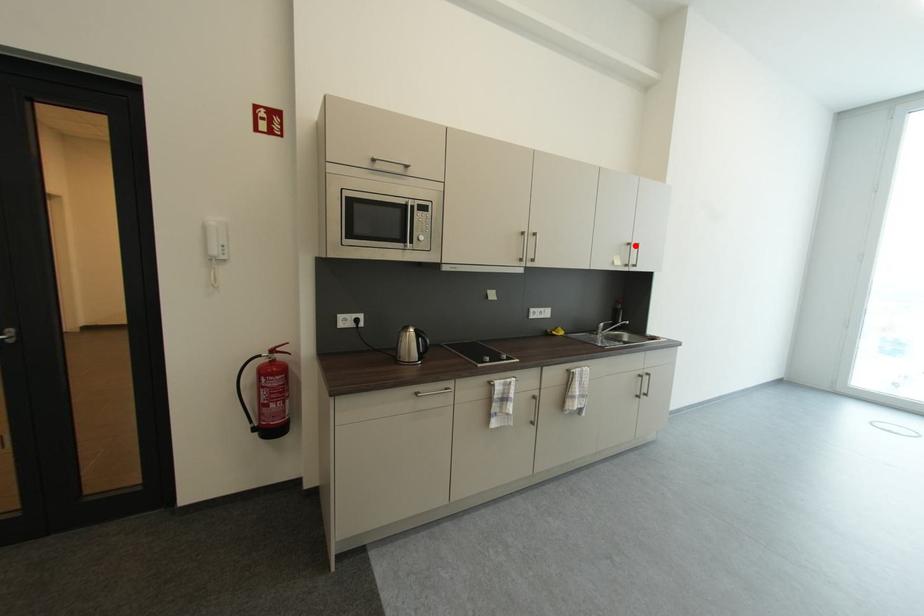
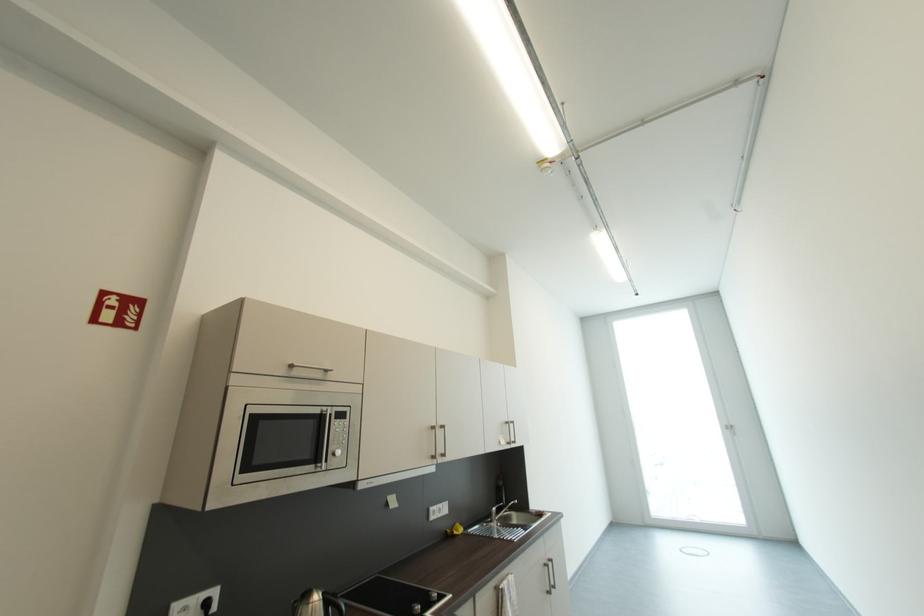
Locate, in the second image, the point that corresponds to the highlighted location in the first image.

(513, 424)